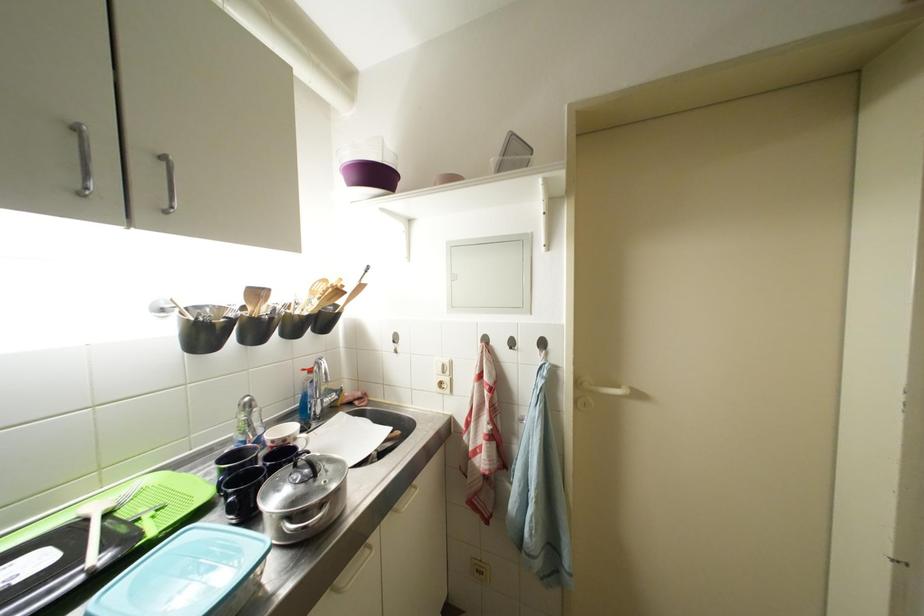
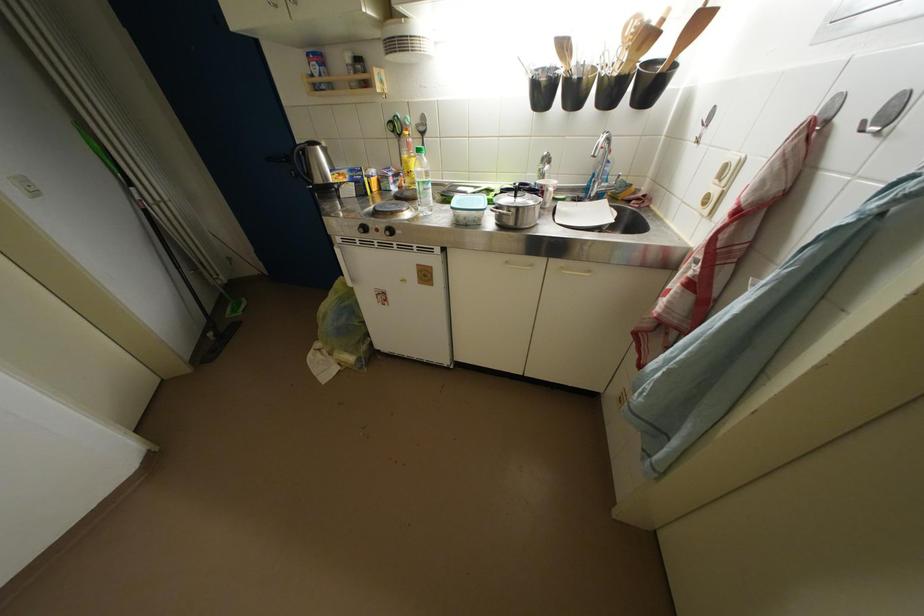
In the second image, find the point that corresponds to the point at 322,307 in the first image.

(631, 60)